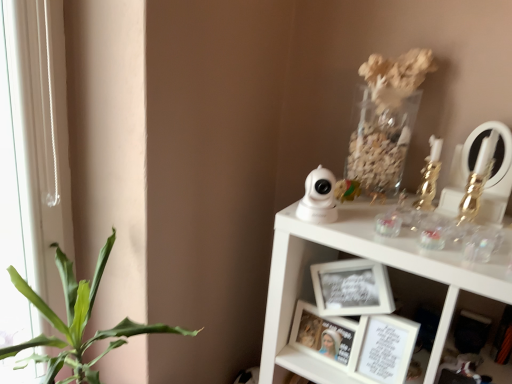
Question: From the image's perspective, does matte white picture frame at center, the 1th picture frame from the left, appear lower than white glossy security camera at upper right, arranged as the 1th toy when viewed from the left?

Choices:
 (A) yes
 (B) no

Answer: (A)

Question: Does matte white picture frame at center, the 1th picture frame from the left, come behind white glossy security camera at upper right, which is counted as the second toy, starting from the right?

Choices:
 (A) no
 (B) yes

Answer: (B)

Question: Considering the relative sizes of matte white picture frame at center, the 1th picture frame from the left, and white glossy security camera at upper right, which is counted as the second toy, starting from the right, in the image provided, is matte white picture frame at center, the 1th picture frame from the left, bigger than white glossy security camera at upper right, which is counted as the second toy, starting from the right,?

Choices:
 (A) no
 (B) yes

Answer: (B)

Question: From a real-world perspective, is matte white picture frame at center, the 2th picture frame in the right-to-left sequence, on top of white glossy security camera at upper right, arranged as the 1th toy when viewed from the left?

Choices:
 (A) yes
 (B) no

Answer: (B)

Question: Is matte white picture frame at center, the 2th picture frame in the right-to-left sequence, positioned in front of white glossy security camera at upper right, which is counted as the second toy, starting from the right?

Choices:
 (A) yes
 (B) no

Answer: (B)

Question: In terms of size, does gold metallic candle holder at upper right appear bigger or smaller than gold metallic candlestick at upper right, which ranks as the first toy in right-to-left order?

Choices:
 (A) small
 (B) big

Answer: (A)

Question: In the image, is gold metallic candle holder at upper right on the left side or the right side of gold metallic candlestick at upper right, the 2th toy viewed from the left?

Choices:
 (A) right
 (B) left

Answer: (B)

Question: Do you think gold metallic candle holder at upper right is within gold metallic candlestick at upper right, the 2th toy viewed from the left, or outside of it?

Choices:
 (A) outside
 (B) inside

Answer: (A)

Question: Considering the positions of gold metallic candle holder at upper right and gold metallic candlestick at upper right, which ranks as the first toy in right-to-left order, in the image, is gold metallic candle holder at upper right wider or thinner than gold metallic candlestick at upper right, which ranks as the first toy in right-to-left order,?

Choices:
 (A) thin
 (B) wide

Answer: (B)

Question: From a real-world perspective, is white matte picture frame at lower center, placed as the second picture frame when sorted from left to right, positioned above or below matte white picture frame at center, the 2th picture frame in the right-to-left sequence?

Choices:
 (A) above
 (B) below

Answer: (A)

Question: In the image, is white matte picture frame at lower center, which is counted as the first picture frame, starting from the right, on the left side or the right side of matte white picture frame at center, the 1th picture frame from the left?

Choices:
 (A) left
 (B) right

Answer: (B)

Question: Considering the positions of white matte picture frame at lower center, placed as the second picture frame when sorted from left to right, and matte white picture frame at center, the 1th picture frame from the left, in the image, is white matte picture frame at lower center, placed as the second picture frame when sorted from left to right, bigger or smaller than matte white picture frame at center, the 1th picture frame from the left,?

Choices:
 (A) big
 (B) small

Answer: (B)

Question: In terms of width, does white matte picture frame at lower center, which is counted as the first picture frame, starting from the right, look wider or thinner when compared to matte white picture frame at center, the 2th picture frame in the right-to-left sequence?

Choices:
 (A) wide
 (B) thin

Answer: (A)

Question: In terms of width, does matte white picture frame at center, the 1th picture frame from the left, look wider or thinner when compared to green leafy plant at left?

Choices:
 (A) wide
 (B) thin

Answer: (B)

Question: From the image's perspective, is matte white picture frame at center, the 1th picture frame from the left, located above or below green leafy plant at left?

Choices:
 (A) above
 (B) below

Answer: (A)